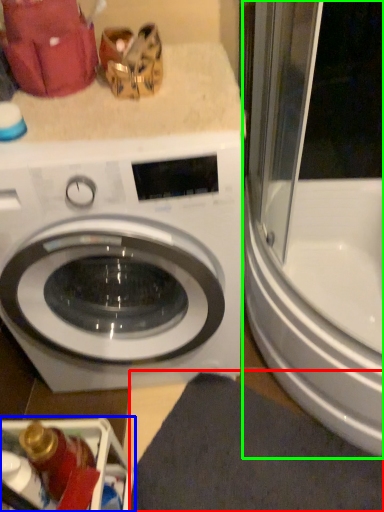
Question: Which is nearer to the bath mat (highlighted by a red box)? dish washer (highlighted by a blue box) or screen door (highlighted by a green box).

Choices:
 (A) dish washer
 (B) screen door

Answer: (A)